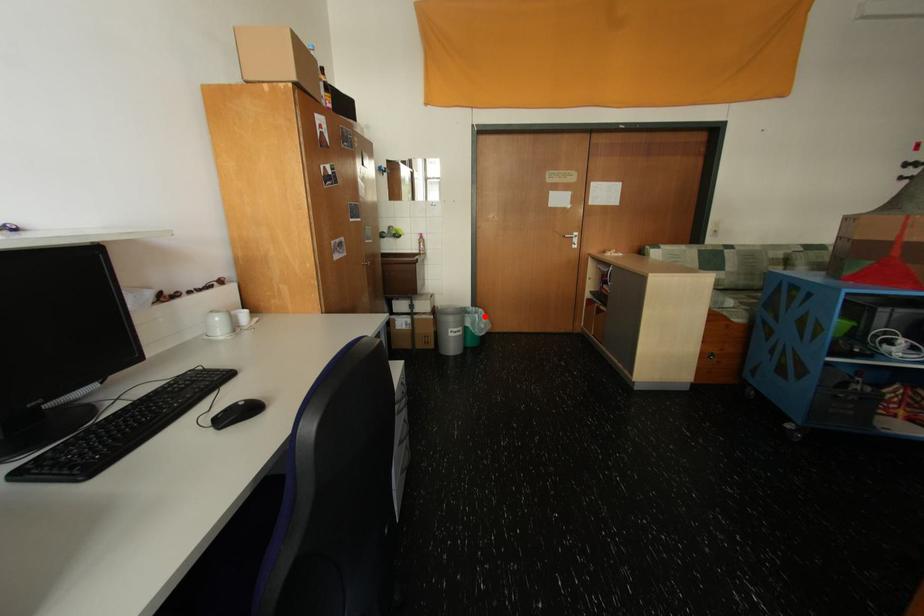
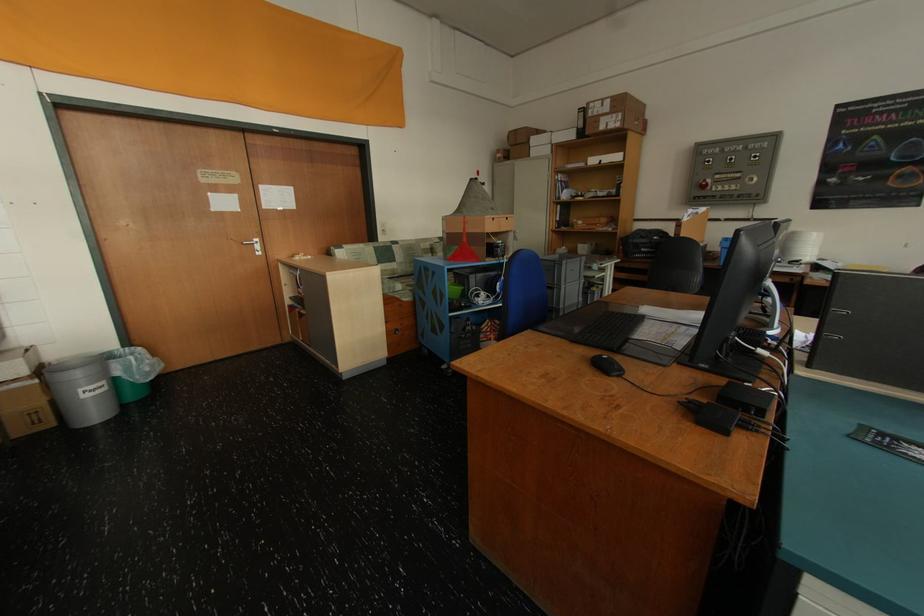
Where in the second image is the point corresponding to the highlighted location from the first image?

(140, 359)